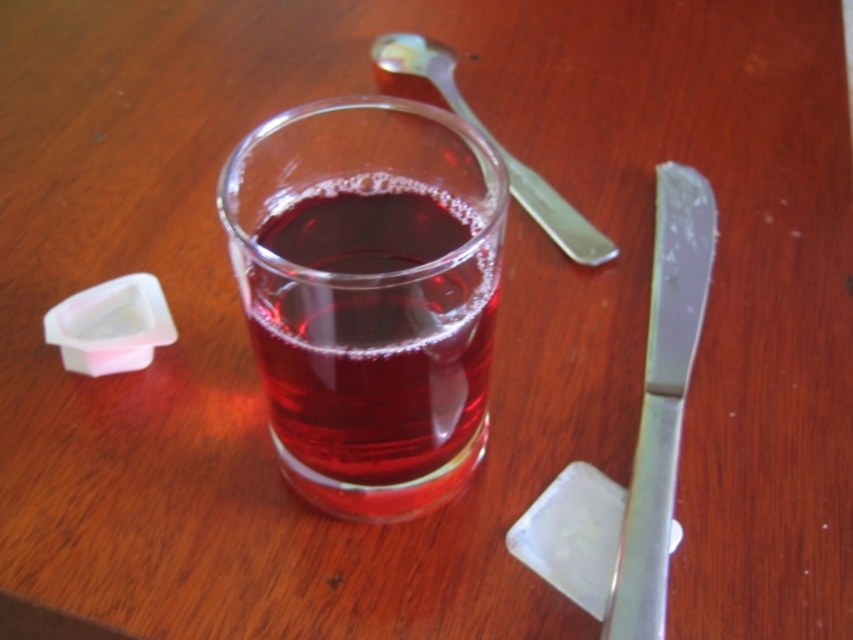
Question: Is translucent glass beverage at center positioned in front of silver metallic spoon at upper center?

Choices:
 (A) yes
 (B) no

Answer: (A)

Question: Considering the relative positions of translucent glass beverage at center and silver metallic spoon at upper center in the image provided, where is translucent glass beverage at center located with respect to silver metallic spoon at upper center?

Choices:
 (A) right
 (B) left

Answer: (B)

Question: Which object is farther from the camera taking this photo?

Choices:
 (A) translucent glass beverage at center
 (B) silver metallic spoon at upper center

Answer: (B)

Question: Which object appears closest to the camera in this image?

Choices:
 (A) translucent glass beverage at center
 (B) polished metal butter knife at right
 (C) silver metallic spoon at upper center

Answer: (A)

Question: Which is farther from the polished metal butter knife at right?

Choices:
 (A) silver metallic spoon at upper center
 (B) translucent glass beverage at center

Answer: (B)

Question: Can you confirm if translucent glass beverage at center is positioned to the right of silver metallic spoon at upper center?

Choices:
 (A) yes
 (B) no

Answer: (B)